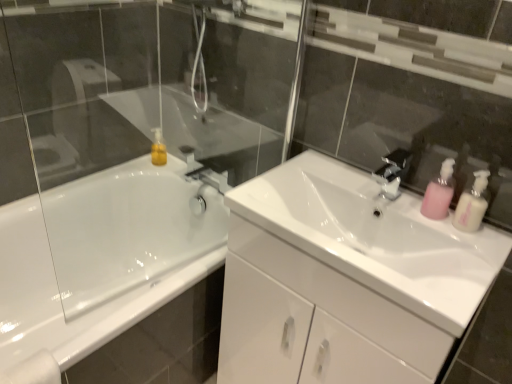
The image size is (512, 384). In order to click on vacant area that is in front of black metallic faucet at upper center in this screenshot , I will do `click(420, 223)`.